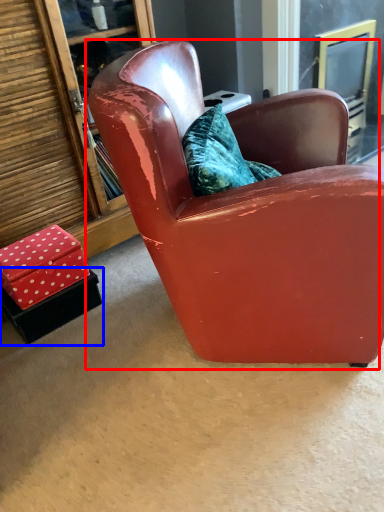
Question: Among these objects, which one is nearest to the camera, chair (highlighted by a red box) or box (highlighted by a blue box)?

Choices:
 (A) chair
 (B) box

Answer: (A)